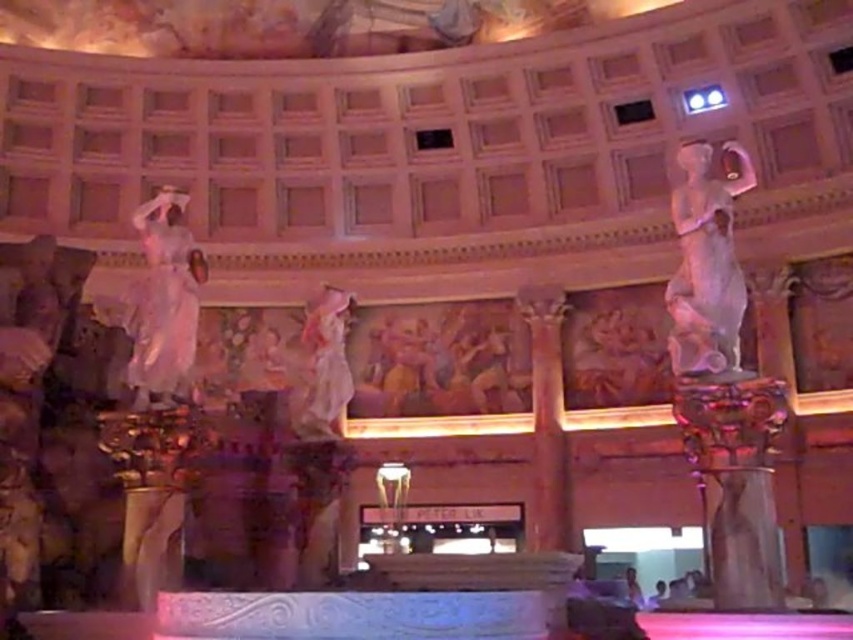
Question: Can you confirm if white marble statue at left is thinner than white marble statue at center?

Choices:
 (A) no
 (B) yes

Answer: (A)

Question: Considering the relative positions of white marble statue at left and white marble statue at center in the image provided, where is white marble statue at left located with respect to white marble statue at center?

Choices:
 (A) above
 (B) below

Answer: (A)

Question: Which object is positioned closest to the white marble statue at center?

Choices:
 (A) white marble statue at right
 (B) white marble statue at left

Answer: (B)

Question: Which point is farther from the camera taking this photo?

Choices:
 (A) (337, 394)
 (B) (160, 310)
 (C) (685, 176)

Answer: (C)

Question: Can you confirm if white marble statue at right is positioned above white marble statue at left?

Choices:
 (A) yes
 (B) no

Answer: (B)

Question: Which of the following is the closest to the observer?

Choices:
 (A) white marble statue at center
 (B) white marble statue at right

Answer: (B)